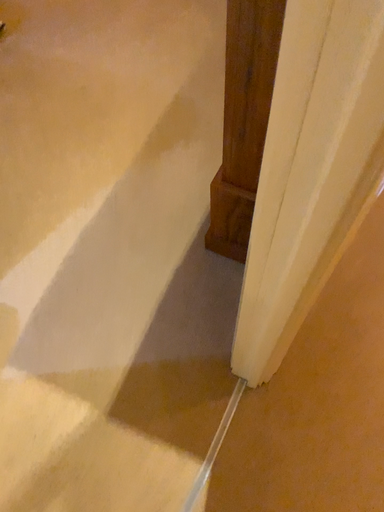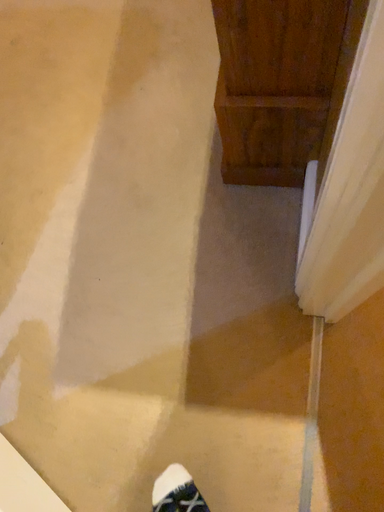
Question: Which way did the camera rotate in the video?

Choices:
 (A) rotated downward
 (B) rotated upward

Answer: (A)